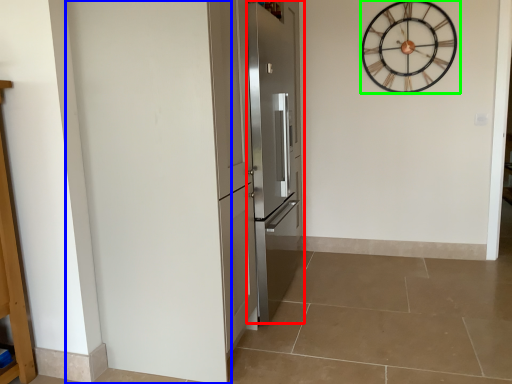
Question: Based on their relative distances, which object is farther from door (highlighted by a red box)? Choose from door (highlighted by a blue box) and wall clock (highlighted by a green box).

Choices:
 (A) door
 (B) wall clock

Answer: (B)